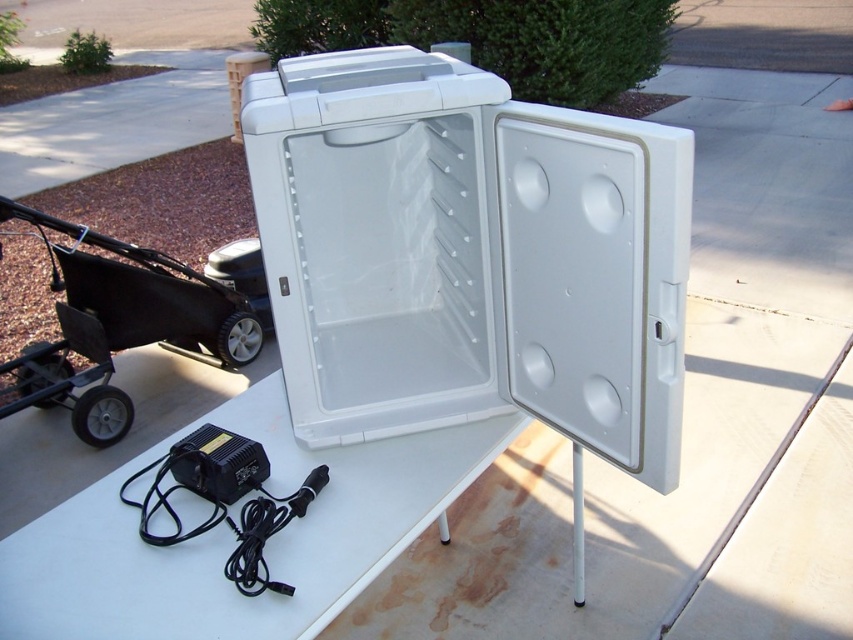
Question: Among these objects, which one is nearest to the camera?

Choices:
 (A) white plastic cooler at center
 (B) black plastic baby carriage at lower left

Answer: (A)

Question: Is white plastic cooler at center behind white plastic table at center?

Choices:
 (A) yes
 (B) no

Answer: (B)

Question: From the image, what is the correct spatial relationship of white plastic table at center in relation to black plastic baby carriage at lower left?

Choices:
 (A) above
 (B) below

Answer: (B)

Question: Estimate the real-world distances between objects in this image. Which object is farther from the white plastic cooler at center?

Choices:
 (A) white plastic table at center
 (B) black plastic baby carriage at lower left

Answer: (B)

Question: Is white plastic cooler at center positioned in front of black plastic baby carriage at lower left?

Choices:
 (A) yes
 (B) no

Answer: (A)

Question: Which object is the closest to the white plastic table at center?

Choices:
 (A) black plastic baby carriage at lower left
 (B) white plastic cooler at center

Answer: (B)